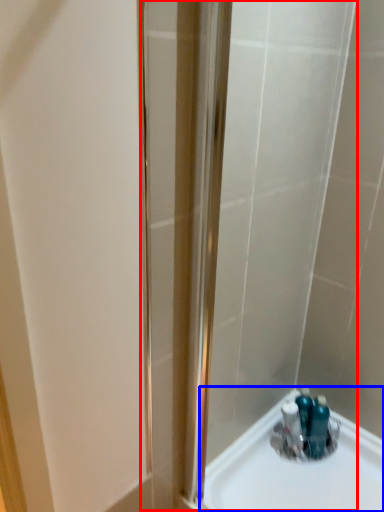
Question: Which of the following is the farthest to the observer, shower door (highlighted by a red box) or sink (highlighted by a blue box)?

Choices:
 (A) shower door
 (B) sink

Answer: (B)